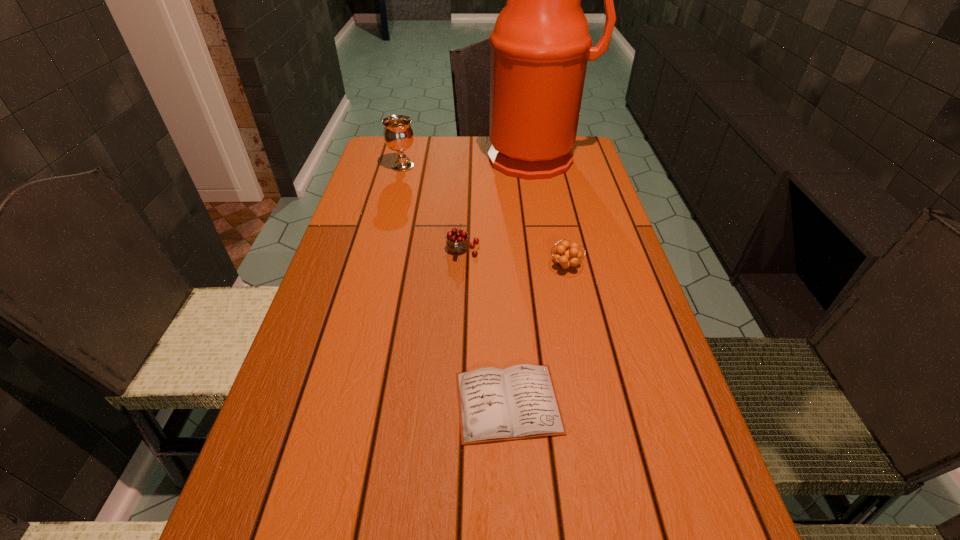
Locate an element on the screen. Image resolution: width=960 pixels, height=540 pixels. the tallest object is located at coordinates (540, 45).

Locate an element on the screen. This screenshot has height=540, width=960. the second tallest object is located at coordinates (398, 135).

The image size is (960, 540). Find the location of `the leftmost object`. the leftmost object is located at coordinates (398, 135).

Locate an element on the screen. Image resolution: width=960 pixels, height=540 pixels. the third tallest object is located at coordinates (457, 242).

Find the location of a particular element. orange fruit is located at coordinates (571, 256).

Locate an element on the screen. Image resolution: width=960 pixels, height=540 pixels. the nearest object is located at coordinates (518, 402).

Where is `the shortest object`? Image resolution: width=960 pixels, height=540 pixels. the shortest object is located at coordinates (518, 402).

At what (x,y) coordinates should I click in order to perform the action: click on vacant space situated 0.290m from the spout of the water jug. Please return your answer as a coordinate pair (x, y). This screenshot has height=540, width=960. Looking at the image, I should click on (553, 239).

This screenshot has height=540, width=960. What are the coordinates of `vacant space positioned 0.140m on the back of the chalice` in the screenshot? It's located at (409, 140).

Find the location of a particular element. Image resolution: width=960 pixels, height=540 pixels. free space located on the handle side of the cherry is located at coordinates (457, 379).